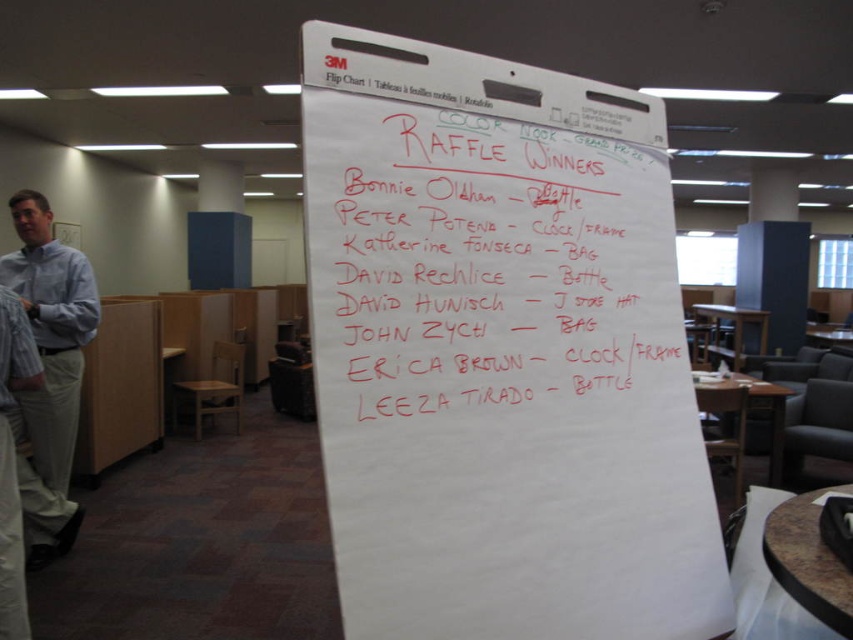
Question: Can you confirm if white paperboard at center is positioned to the left of white marker text at center?

Choices:
 (A) no
 (B) yes

Answer: (A)

Question: Does white marker text at center come in front of blue shirt at left?

Choices:
 (A) yes
 (B) no

Answer: (A)

Question: Among these points, which one is farthest from the camera?

Choices:
 (A) (33, 516)
 (B) (592, 244)
 (C) (51, 298)
 (D) (526, 419)

Answer: (C)

Question: Does white marker text at center appear on the right side of blue striped shirt at left?

Choices:
 (A) yes
 (B) no

Answer: (A)

Question: Which of the following is the farthest from the observer?

Choices:
 (A) (345, 410)
 (B) (9, 268)

Answer: (B)

Question: Which object is the closest to the white paperboard at center?

Choices:
 (A) white marker text at center
 (B) blue striped shirt at left
 (C) blue shirt at left

Answer: (A)